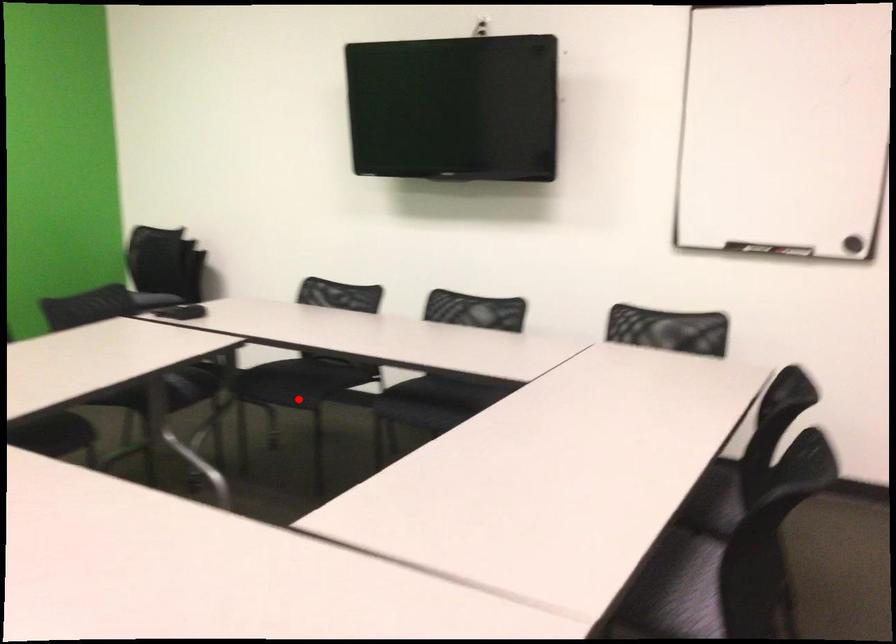
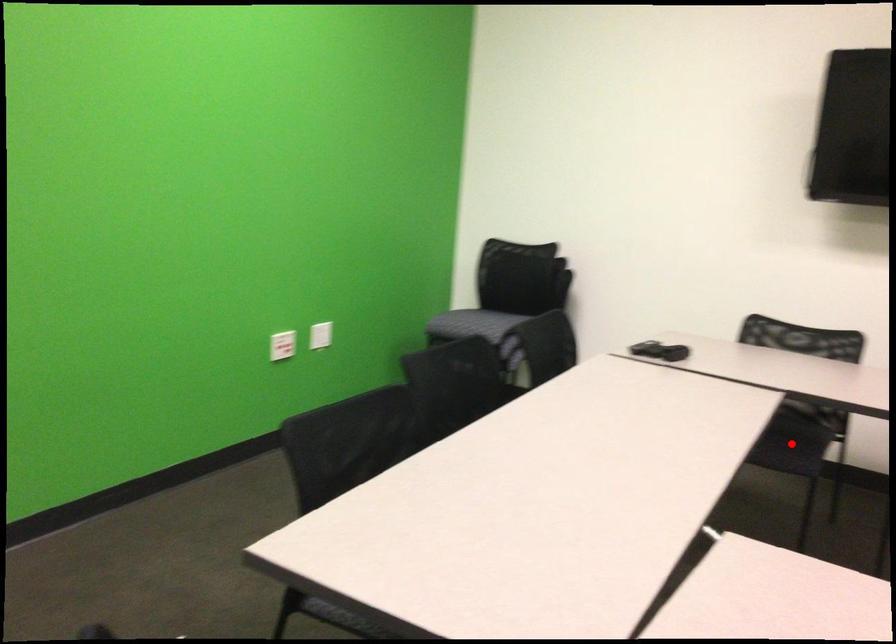
I am providing you with two images of the same scene from different viewpoints. A red point is marked on the first image and another point is marked on the second image. Do the highlighted points in image1 and image2 indicate the same real-world spot?

Yes